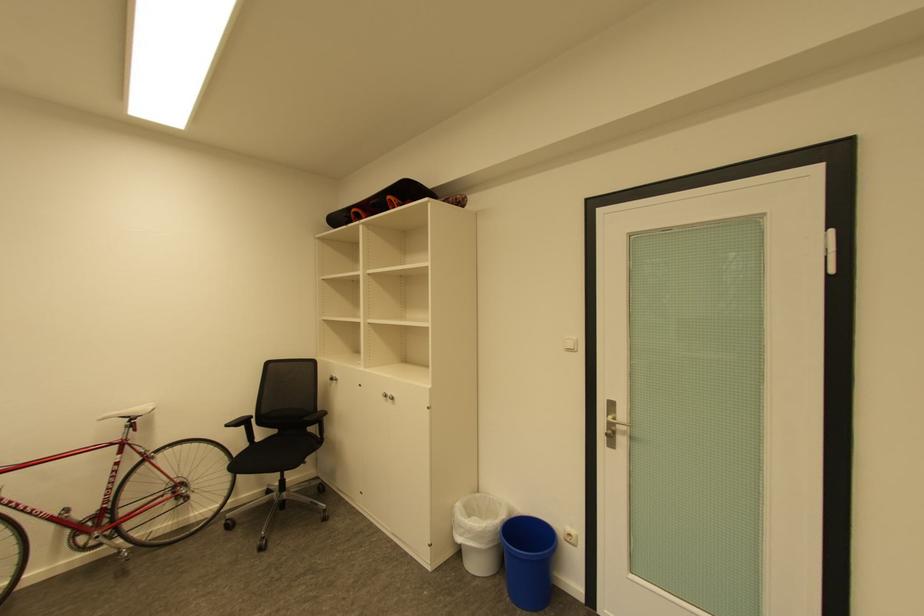
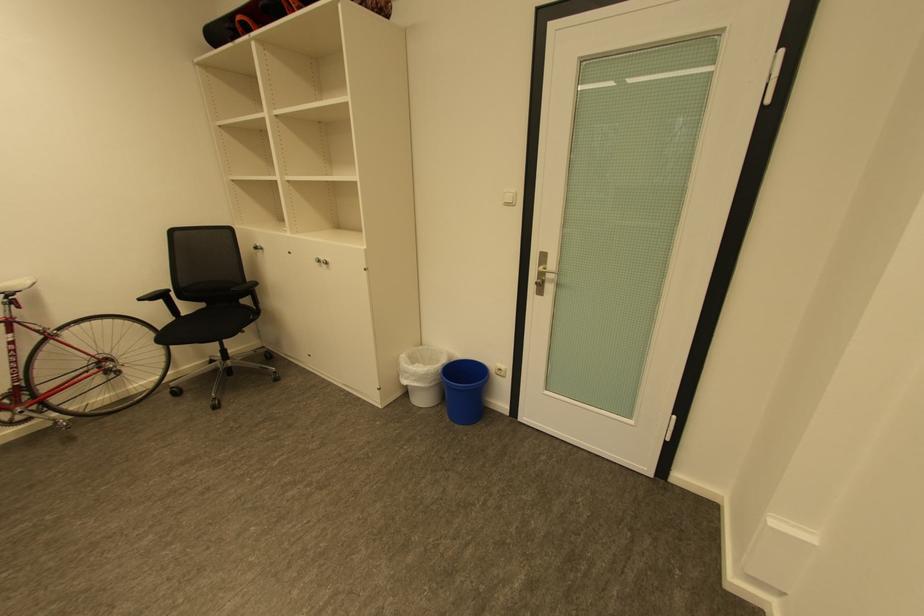
Question: I am providing you with two images of the same scene from different viewpoints. Which of the following objects are not visible in image2?

Choices:
 (A) white light switch
 (B) silver door handle
 (C) chair sitting surface
 (D) none of these

Answer: (D)